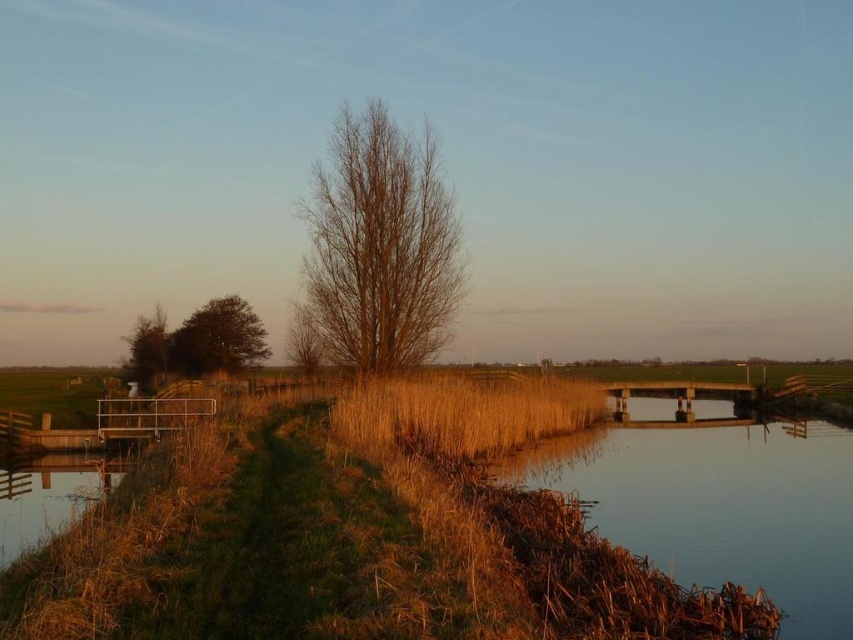
You are standing at the center of the image and want to walk towards the brown grassy river at lower right. Which direction should you face to head directly towards it?

The brown grassy river at lower right is located at coordinates point [717,500], so you should face towards the lower right direction to head directly towards it.

You are standing at the edge of the grassy embankment in the rural landscape scene. You notice two points in the image labeled as point [364,164] and point [137,339]. Which of these points is nearer to you?

Point [364,164] is closer to the viewer than point [137,339].

You are standing on the wooden bridge in the scene. Looking towards the direction of the brown grassy river at lower right and the green matte tree at left, which object is positioned to your right?

The brown grassy river at lower right is positioned to your right compared to the green matte tree at left.